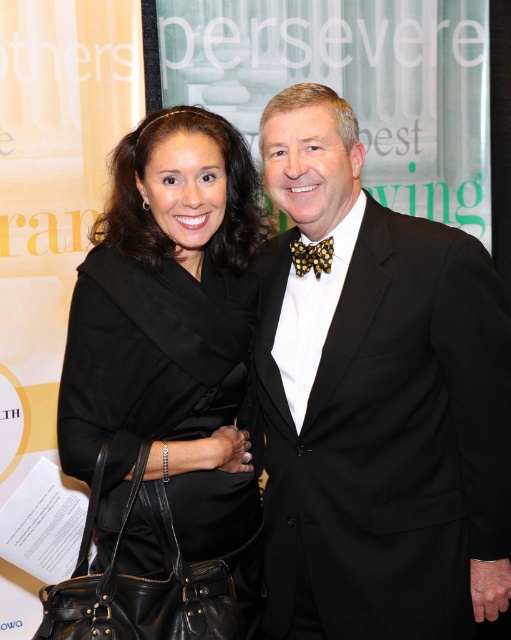
You are taking a photo of two people at a formal event. You notice two points in the image labeled as point 1 and point 2. Point 1 has coordinates [448,481] and point 2 has coordinates [85,419]. Based on their positions, which point is closer to the camera?

Point 1 is closer to the camera because it is further to the camera than point 2.

You are a photographer at a formal event. You need to decide which of the two items, the black satin suit at center or the yellow dotted bow tie at center, will require more fabric to cover it completely. Which one would you choose?

The black satin suit at center is larger in size than the yellow dotted bow tie at center, so it would require more fabric to cover it completely.

You are a photographer at a formal event. You need to decide whether to adjust the camera focus to ensure both the black leather handbag at lower left and the yellow dotted bow tie at center are in focus. Given their heights, which object should you prioritize focusing on first?

The black leather handbag at lower left is taller than the yellow dotted bow tie at center, so you should prioritize focusing on the black leather handbag at lower left first to ensure proper depth of field.